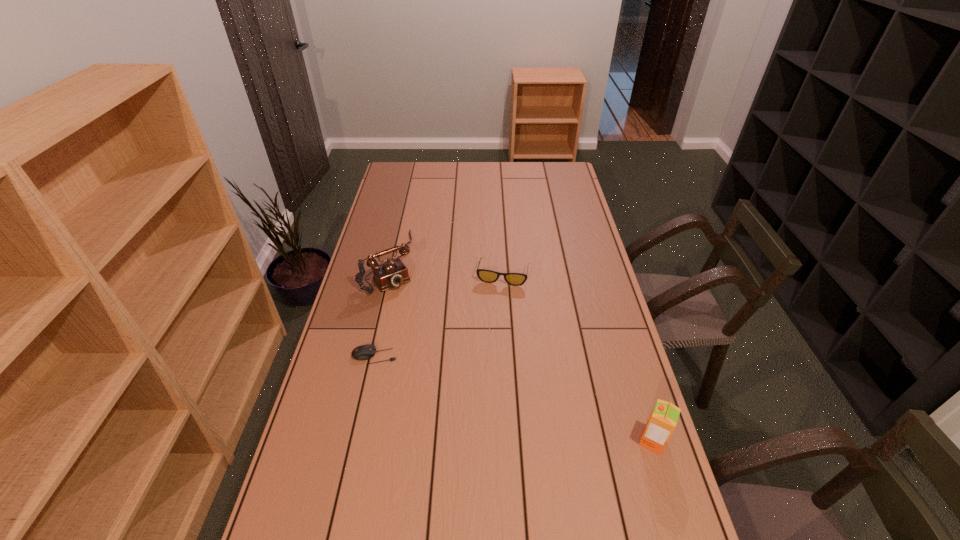
You are a GUI agent. You are given a task and a screenshot of the screen. Output one action in this format:
    pyautogui.click(x=<x>, y=<y>)
    Task: Click on the second nearest object
    The image size is (960, 540).
    Given the screenshot: What is the action you would take?
    pyautogui.click(x=364, y=352)

Identify the location of mouse. Image resolution: width=960 pixels, height=540 pixels. (364, 352).

The height and width of the screenshot is (540, 960). What are the coordinates of `the nearest object` in the screenshot? It's located at (663, 419).

This screenshot has height=540, width=960. What are the coordinates of `the rightmost object` in the screenshot? It's located at (663, 419).

This screenshot has height=540, width=960. I want to click on sunglasses, so pos(516,279).

Where is `the third object from left to right`? the third object from left to right is located at coordinates (516, 279).

Identify the location of telephone. (393, 273).

In order to click on vacant space located 0.290m on the back of the second nearest object in this screenshot , I will do `click(390, 285)`.

Where is `blank space located on the left of the nearest object`? blank space located on the left of the nearest object is located at coordinates (562, 441).

You are a GUI agent. You are given a task and a screenshot of the screen. Output one action in this format:
    pyautogui.click(x=<x>, y=<y>)
    Task: Click on the vacant space situated on the front-facing side of the second shortest object
    The width and height of the screenshot is (960, 540).
    Given the screenshot: What is the action you would take?
    pyautogui.click(x=489, y=338)